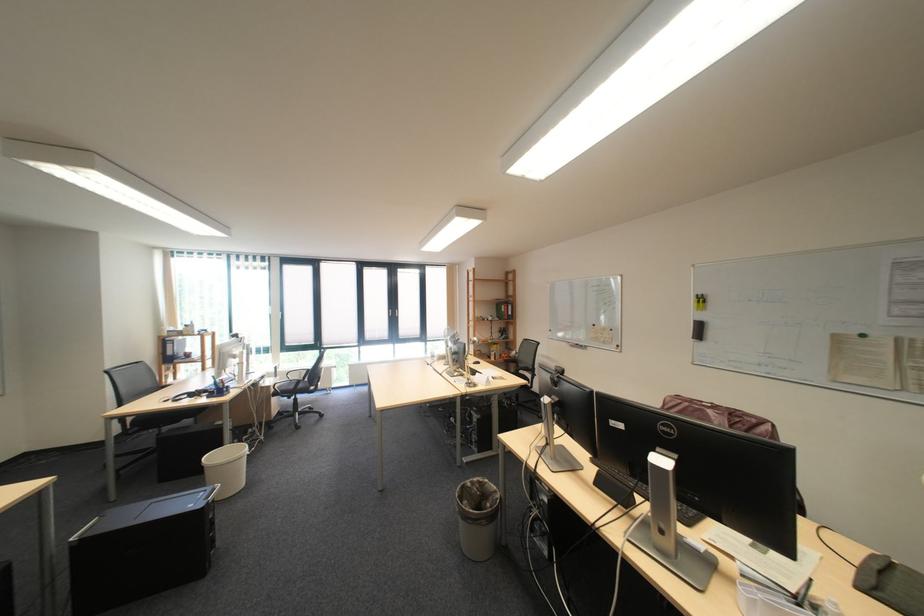
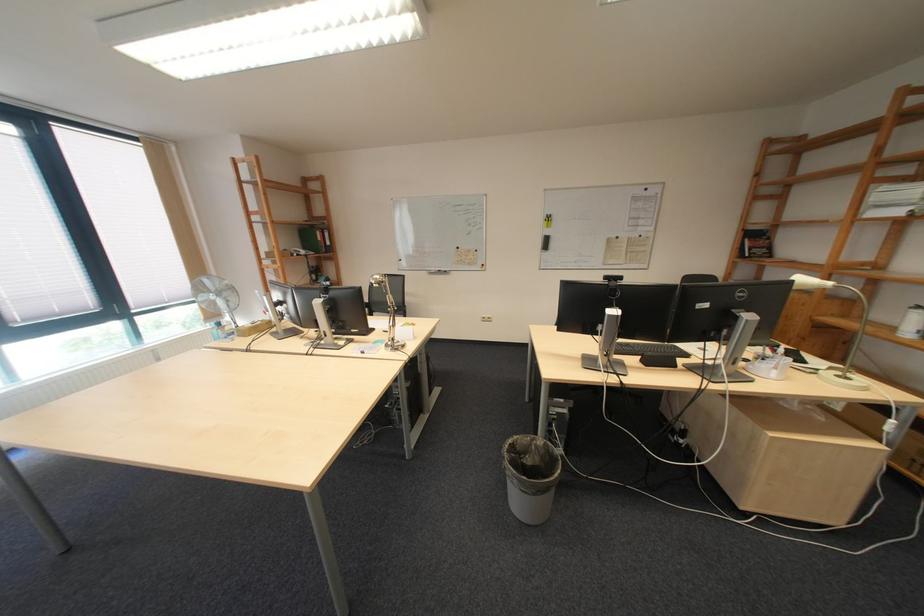
Find the pixel in the second image that matches point 515,336 in the first image.

(329, 278)